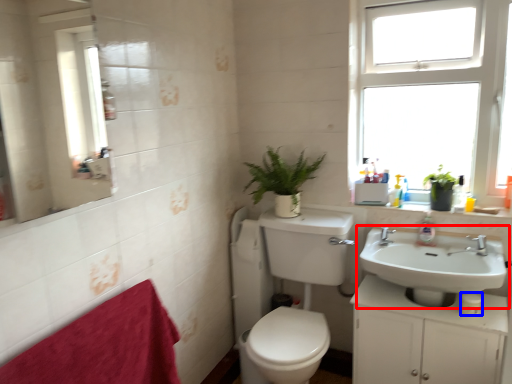
Question: Among these objects, which one is nearest to the camera, sink (highlighted by a red box) or toilet paper (highlighted by a blue box)?

Choices:
 (A) sink
 (B) toilet paper

Answer: (A)